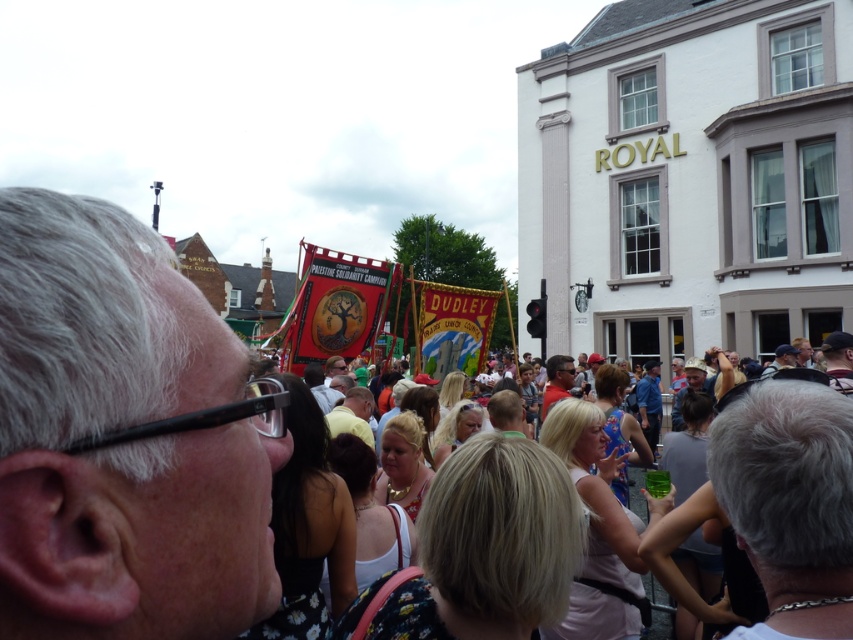
Is point (648, 365) in front of point (544, 362)?

That is True.

Describe the element at coordinates (648, 403) in the screenshot. I see `blue denim shirt at center` at that location.

Which is in front, point (650, 384) or point (544, 400)?

Point (544, 400) is in front.

Find the location of a particular element. The image size is (853, 640). blue denim shirt at center is located at coordinates tap(648, 403).

Who is higher up, gray hair at upper left or blue denim shirt at center?

gray hair at upper left is above.

Is gray hair at upper left below blue denim shirt at center?

Incorrect, gray hair at upper left is not positioned below blue denim shirt at center.

Identify the location of gray hair at upper left. Image resolution: width=853 pixels, height=640 pixels. (120, 442).

Between light brown hair at center and light brown leather jacket at center, which one has more height?

Standing taller between the two is light brown hair at center.

Can you confirm if light brown hair at center is positioned above light brown leather jacket at center?

Actually, light brown hair at center is below light brown leather jacket at center.

Locate an element on the screen. The image size is (853, 640). light brown hair at center is located at coordinates (352, 413).

You are a GUI agent. You are given a task and a screenshot of the screen. Output one action in this format:
    pyautogui.click(x=<x>, y=<y>)
    Task: Click on the light brown hair at center
    
    Given the screenshot: What is the action you would take?
    pyautogui.click(x=352, y=413)